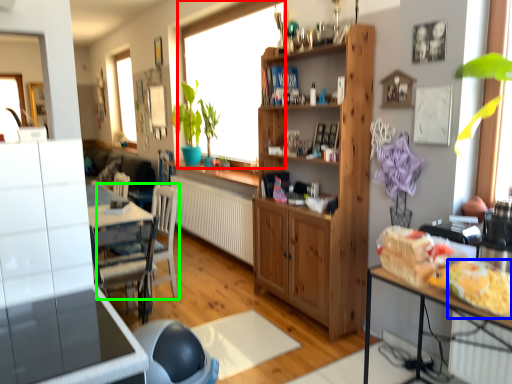
Question: Based on their relative distances, which object is nearer to window (highlighted by a red box)? Choose from food (highlighted by a blue box) and chair (highlighted by a green box).

Choices:
 (A) food
 (B) chair

Answer: (B)